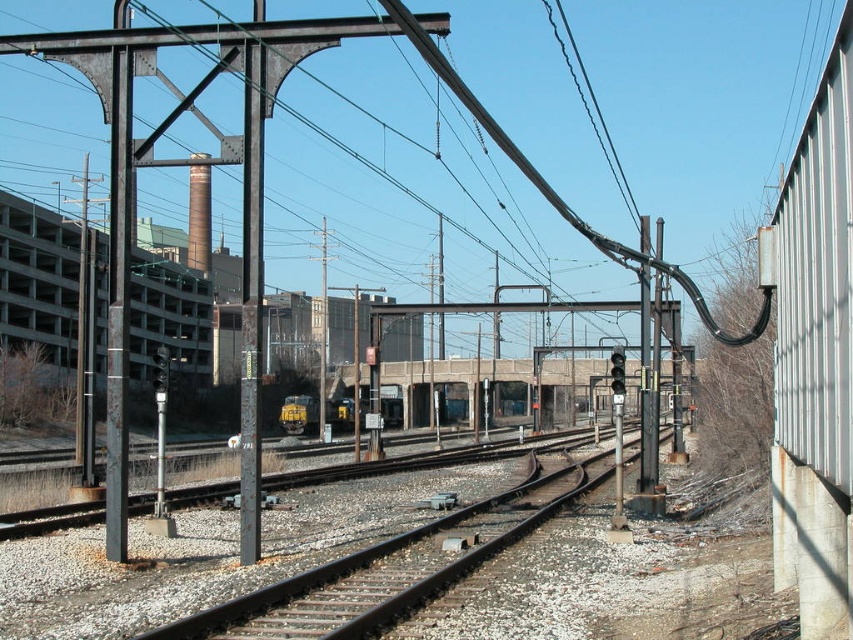
Question: Is rusty metal pole at left below rusty metal pole at center?

Choices:
 (A) yes
 (B) no

Answer: (A)

Question: Can you confirm if black wire at upper center is wider than yellow matte train at center?

Choices:
 (A) yes
 (B) no

Answer: (A)

Question: Which object is closer to the camera taking this photo?

Choices:
 (A) yellow matte train at center
 (B) smooth steel tracks at center
 (C) rusty metal pole at center

Answer: (B)

Question: Which of the following is the closest to the observer?

Choices:
 (A) rusty metal pole at left
 (B) black wire at upper center

Answer: (A)

Question: Does rusty metal pole at left have a lesser width compared to yellow matte train at center?

Choices:
 (A) no
 (B) yes

Answer: (A)

Question: Which object is closer to the camera taking this photo?

Choices:
 (A) smooth steel tracks at center
 (B) rusty metal pole at left

Answer: (A)